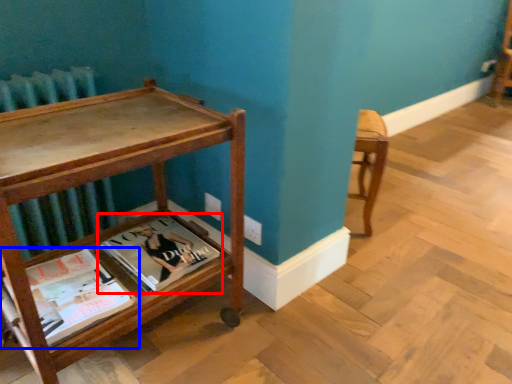
Question: Which point is further to the camera, book (highlighted by a red box) or book (highlighted by a blue box)?

Choices:
 (A) book
 (B) book

Answer: (A)